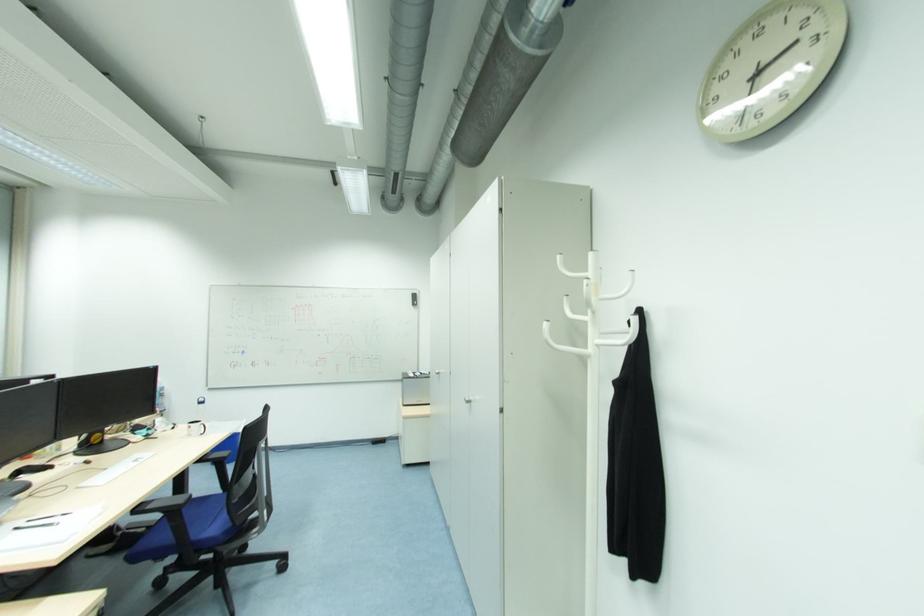
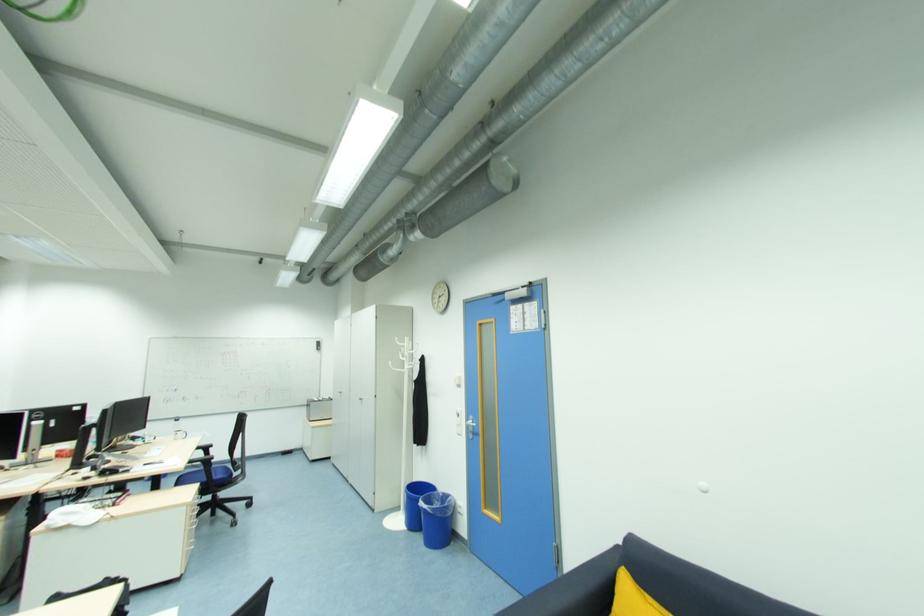
Question: What movement of the cameraman would produce the second image?

Choices:
 (A) Left
 (B) Right
 (C) Forward
 (D) Backward

Answer: (D)